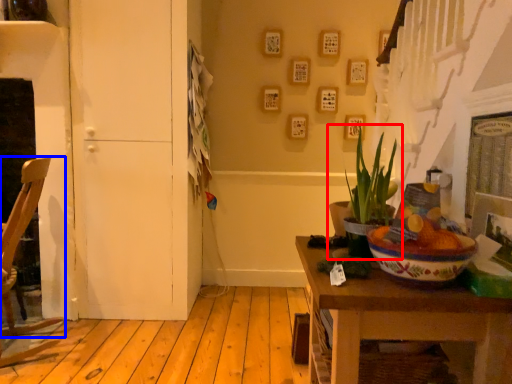
Question: Which object appears closest to the camera in this image, houseplant (highlighted by a red box) or chair (highlighted by a blue box)?

Choices:
 (A) houseplant
 (B) chair

Answer: (A)